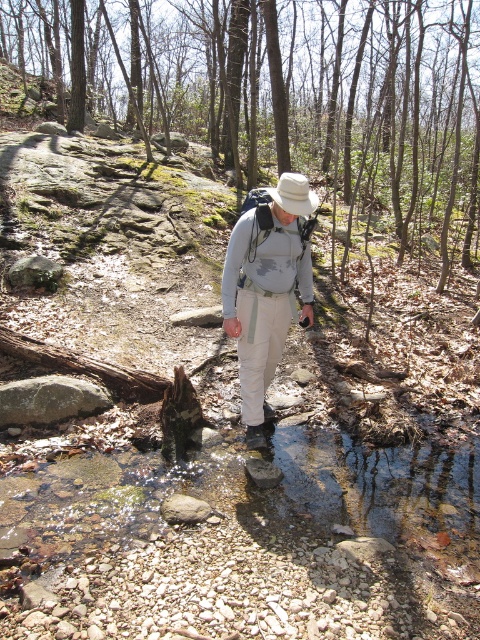
Question: Is matte gray shirt at center further to the viewer compared to rubber/muddy hiking boot at center?

Choices:
 (A) no
 (B) yes

Answer: (A)

Question: Is white fabric hat at center below rubber/muddy hiking boot at center?

Choices:
 (A) no
 (B) yes

Answer: (A)

Question: Based on their relative distances, which object is nearer to the rubber/muddy hiking boot at center?

Choices:
 (A) white fabric hat at center
 (B) matte gray shirt at center

Answer: (B)

Question: Based on their relative distances, which object is farther from the matte gray shirt at center?

Choices:
 (A) white fabric hat at center
 (B) rubber/muddy hiking boot at center

Answer: (A)

Question: Where is white fabric hat at center located in relation to rubber/muddy hiking boot at center in the image?

Choices:
 (A) below
 (B) above

Answer: (B)

Question: Estimate the real-world distances between objects in this image. Which object is closer to the matte gray shirt at center?

Choices:
 (A) rubber/muddy hiking boot at center
 (B) white fabric hat at center

Answer: (A)